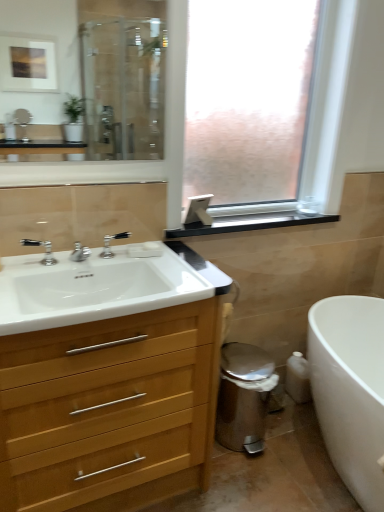
The width and height of the screenshot is (384, 512). In order to click on vacant space in front of polished chrome faucet at sink left, which is the 1th tap in left-to-right order in this screenshot , I will do `click(22, 275)`.